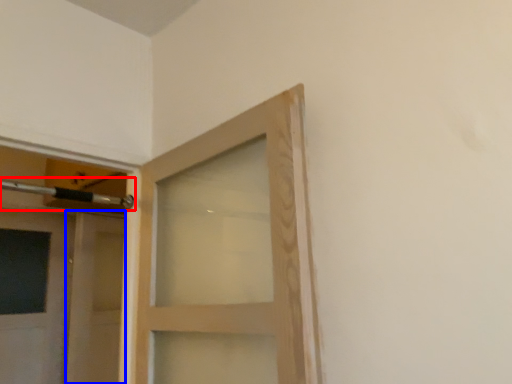
Question: Among these objects, which one is farthest to the camera, door handle (highlighted by a red box) or door (highlighted by a blue box)?

Choices:
 (A) door handle
 (B) door

Answer: (B)